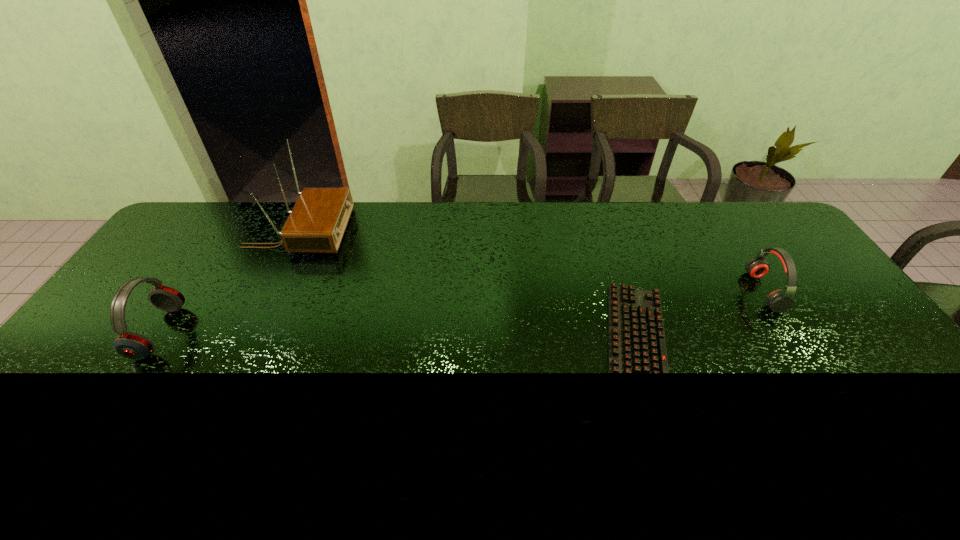
Identify the location of radio_receiver. (317, 223).

This screenshot has height=540, width=960. What are the coordinates of `the farthest object` in the screenshot? It's located at (317, 223).

This screenshot has height=540, width=960. I want to click on the taller earphone, so click(x=131, y=345).

At what (x,y) coordinates should I click in order to perform the action: click on the third shortest object. Please return your answer as a coordinate pair (x, y). This screenshot has width=960, height=540. Looking at the image, I should click on (131, 345).

The width and height of the screenshot is (960, 540). I want to click on the third tallest object, so click(x=779, y=301).

Image resolution: width=960 pixels, height=540 pixels. In order to click on the rightmost object in this screenshot , I will do `click(779, 301)`.

Where is `computer keyboard`? This screenshot has height=540, width=960. computer keyboard is located at coordinates (636, 339).

Image resolution: width=960 pixels, height=540 pixels. I want to click on the third object from left to right, so click(x=636, y=339).

This screenshot has height=540, width=960. What are the coordinates of `vacant space positioned 0.320m on the front panel of the radio_receiver` in the screenshot? It's located at (438, 232).

At what (x,y) coordinates should I click in order to perform the action: click on free space located on the ear cups of the leftmost object. Please return your answer as a coordinate pair (x, y). The width and height of the screenshot is (960, 540). Looking at the image, I should click on (309, 332).